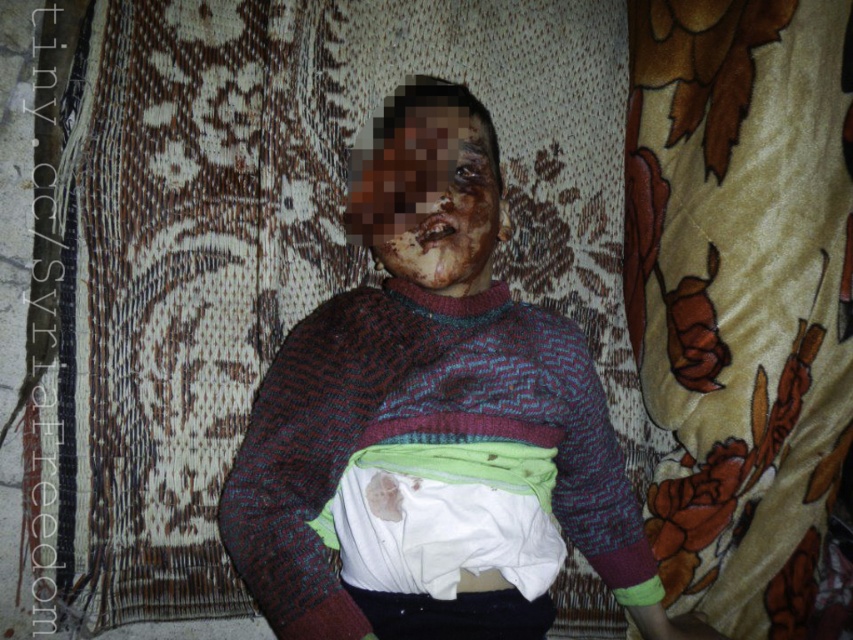
You are a healthcare professional examining a patient. You notice the knitted sweater at center and the scarred skin at center. Which object is located to the right of the other?

The knitted sweater at center is positioned on the right side of scarred skin at center.

You are a nurse assessing a patient lying on a floral rug. The patient has a knitted sweater at center and scarred skin at center. How far apart are these two items from each other?

The knitted sweater at center and scarred skin at center are 6.31 inches apart from each other.

Based on the photo, you are a photographer trying to capture the exact location of a stain on the white cloth covering the person in the image. The stain is marked by a point at coordinates point (434, 445). Based on the scene, where exactly is this point located?

The point (434, 445) is located on the knitted sweater at center, which is where the stain is situated.